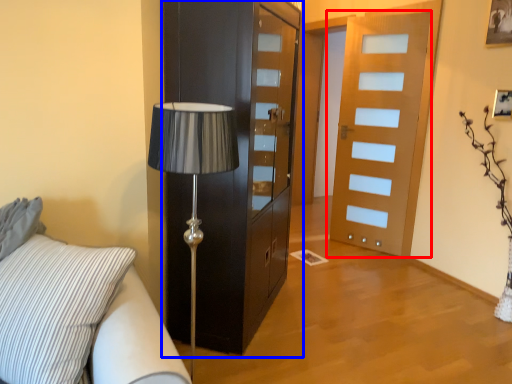
Question: Which point is closer to the camera, door (highlighted by a red box) or cabinetry (highlighted by a blue box)?

Choices:
 (A) door
 (B) cabinetry

Answer: (B)